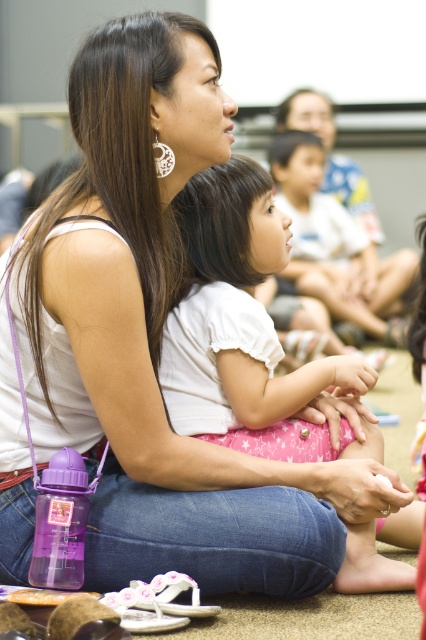
You are organizing a clothing donation drive and need to sort shirts by size. You have two white cotton shirts in front of you. One is labeled as the white cotton shirt at center, and the other is the white cotton shirt at upper center. Which one should you place in the small size bin?

The white cotton shirt at center is smaller than the white cotton shirt at upper center, so it should be placed in the small size bin.

You are a photographer at the event and want to ensure both the white cotton shirt at center and the white cotton shirt at upper center are visible in your photo. Which shirt should you focus on to capture both in the frame?

The white cotton shirt at center is shorter than the white cotton shirt at upper center. To capture both in the frame, focus on the taller one, the white cotton shirt at upper center, as it will help include the shorter one below it.